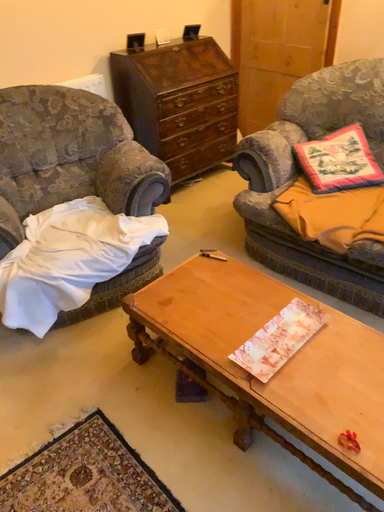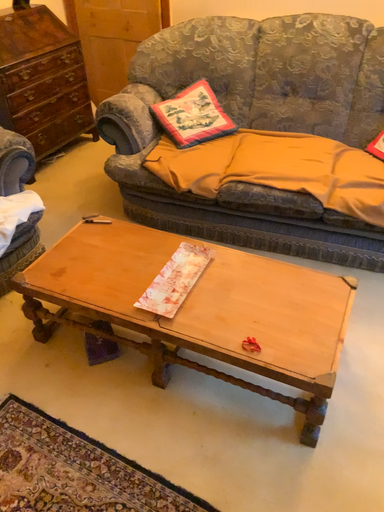
Question: How did the camera likely rotate when shooting the video?

Choices:
 (A) rotated right
 (B) rotated left

Answer: (A)